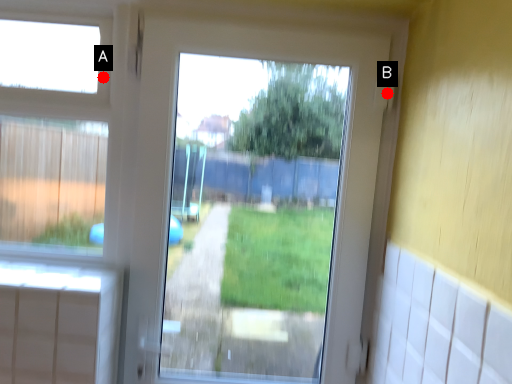
Question: Two points are circled on the image, labeled by A and B beside each circle. Which of the following is the closest to the observer?

Choices:
 (A) A is closer
 (B) B is closer

Answer: (B)